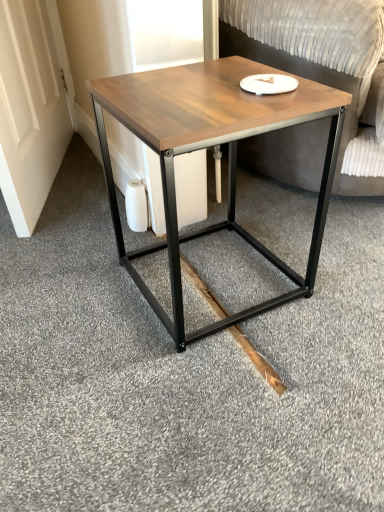
Question: From a real-world perspective, is wooden swivel chair at center located higher than wooden matte coffee table at center?

Choices:
 (A) no
 (B) yes

Answer: (B)

Question: Is the depth of wooden swivel chair at center greater than that of wooden matte coffee table at center?

Choices:
 (A) no
 (B) yes

Answer: (B)

Question: Is wooden swivel chair at center positioned before wooden matte coffee table at center?

Choices:
 (A) yes
 (B) no

Answer: (B)

Question: Is wooden swivel chair at center facing away from wooden matte coffee table at center?

Choices:
 (A) yes
 (B) no

Answer: (B)

Question: Is wooden matte coffee table at center a part of wooden swivel chair at center?

Choices:
 (A) yes
 (B) no

Answer: (B)

Question: Can you confirm if wooden swivel chair at center is smaller than wooden matte coffee table at center?

Choices:
 (A) yes
 (B) no

Answer: (B)

Question: Is natural wood plank at lower center closer to camera compared to wooden swivel chair at center?

Choices:
 (A) no
 (B) yes

Answer: (A)

Question: From the image's perspective, is natural wood plank at lower center located above wooden swivel chair at center?

Choices:
 (A) no
 (B) yes

Answer: (A)

Question: From a real-world perspective, is natural wood plank at lower center under wooden swivel chair at center?

Choices:
 (A) yes
 (B) no

Answer: (A)

Question: Is wooden swivel chair at center inside natural wood plank at lower center?

Choices:
 (A) yes
 (B) no

Answer: (B)

Question: Does natural wood plank at lower center appear on the right side of wooden swivel chair at center?

Choices:
 (A) no
 (B) yes

Answer: (A)

Question: Can you confirm if natural wood plank at lower center is thinner than wooden swivel chair at center?

Choices:
 (A) no
 (B) yes

Answer: (B)

Question: Does wooden matte coffee table at center have a larger size compared to wooden swivel chair at center?

Choices:
 (A) no
 (B) yes

Answer: (A)